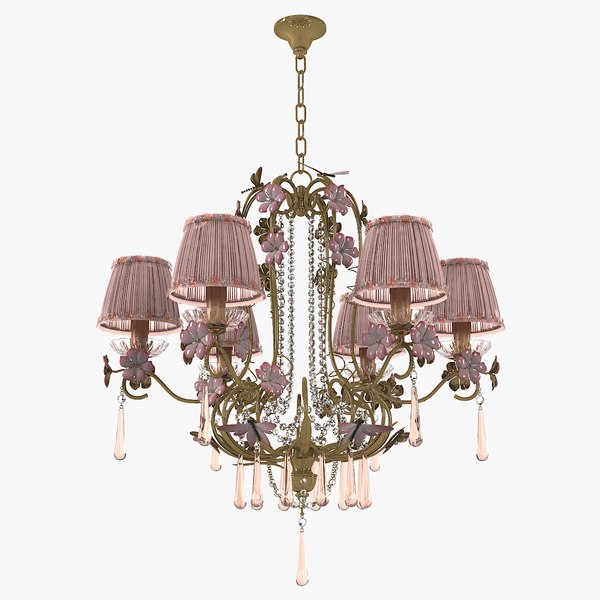
Where is `metal hook`? The image size is (600, 600). metal hook is located at coordinates (309, 175).